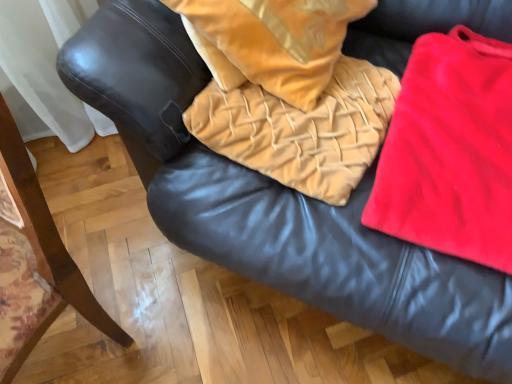
Question: Can you confirm if matte black armrest at left is shorter than velvet tan blanket at center?

Choices:
 (A) no
 (B) yes

Answer: (A)

Question: From a real-world perspective, is matte black armrest at left under velvet tan blanket at center?

Choices:
 (A) no
 (B) yes

Answer: (B)

Question: Would you consider matte black armrest at left to be distant from velvet tan blanket at center?

Choices:
 (A) yes
 (B) no

Answer: (B)

Question: Considering the relative positions of matte black armrest at left and velvet tan blanket at center in the image provided, is matte black armrest at left behind velvet tan blanket at center?

Choices:
 (A) no
 (B) yes

Answer: (A)

Question: Can you confirm if matte black armrest at left is wider than velvet tan blanket at center?

Choices:
 (A) yes
 (B) no

Answer: (B)

Question: In terms of size, does velvet tan blanket at center appear bigger or smaller than velvet tan pillow at center?

Choices:
 (A) big
 (B) small

Answer: (B)

Question: From a real-world perspective, is velvet tan blanket at center positioned above or below velvet tan pillow at center?

Choices:
 (A) below
 (B) above

Answer: (A)

Question: Considering their positions, is velvet tan blanket at center located in front of or behind velvet tan pillow at center?

Choices:
 (A) front
 (B) behind

Answer: (B)

Question: Considering the relative positions of velvet tan blanket at center and velvet tan pillow at center in the image provided, is velvet tan blanket at center to the left or to the right of velvet tan pillow at center?

Choices:
 (A) right
 (B) left

Answer: (A)

Question: Do you think velvet tan blanket at center is within red velvet cloth at right, or outside of it?

Choices:
 (A) outside
 (B) inside

Answer: (A)

Question: In terms of height, does velvet tan blanket at center look taller or shorter compared to red velvet cloth at right?

Choices:
 (A) short
 (B) tall

Answer: (B)

Question: In terms of width, does velvet tan blanket at center look wider or thinner when compared to red velvet cloth at right?

Choices:
 (A) thin
 (B) wide

Answer: (A)

Question: From a real-world perspective, is velvet tan blanket at center positioned above or below red velvet cloth at right?

Choices:
 (A) below
 (B) above

Answer: (B)

Question: From the image's perspective, is red velvet cloth at right located above or below velvet tan blanket at center?

Choices:
 (A) below
 (B) above

Answer: (A)

Question: Is red velvet cloth at right wider or thinner than velvet tan blanket at center?

Choices:
 (A) thin
 (B) wide

Answer: (B)